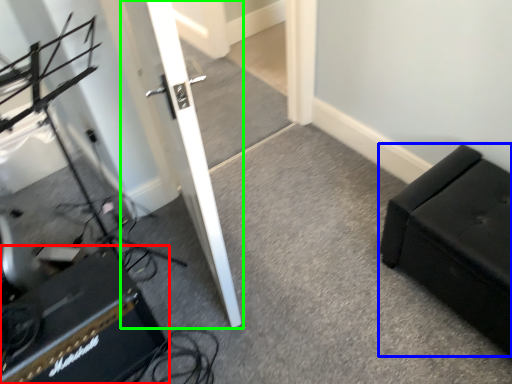
Question: Considering the real-world distances, which object is farthest from speaker (highlighted by a red box)? furniture (highlighted by a blue box) or door (highlighted by a green box)?

Choices:
 (A) furniture
 (B) door

Answer: (A)